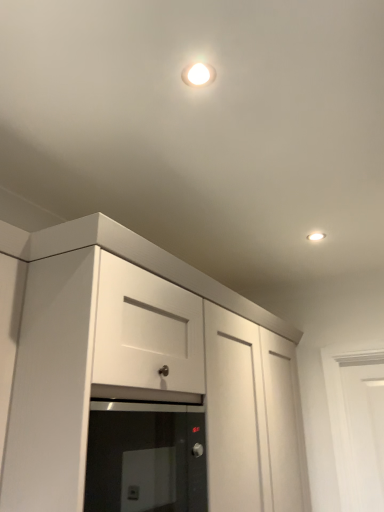
This screenshot has height=512, width=384. What do you see at coordinates (143, 383) in the screenshot?
I see `white matte cabinet at center` at bounding box center [143, 383].

This screenshot has height=512, width=384. I want to click on white matte cabinet at center, so click(x=143, y=383).

The height and width of the screenshot is (512, 384). Identify the location of white matte cabinet at center. [x=143, y=383].